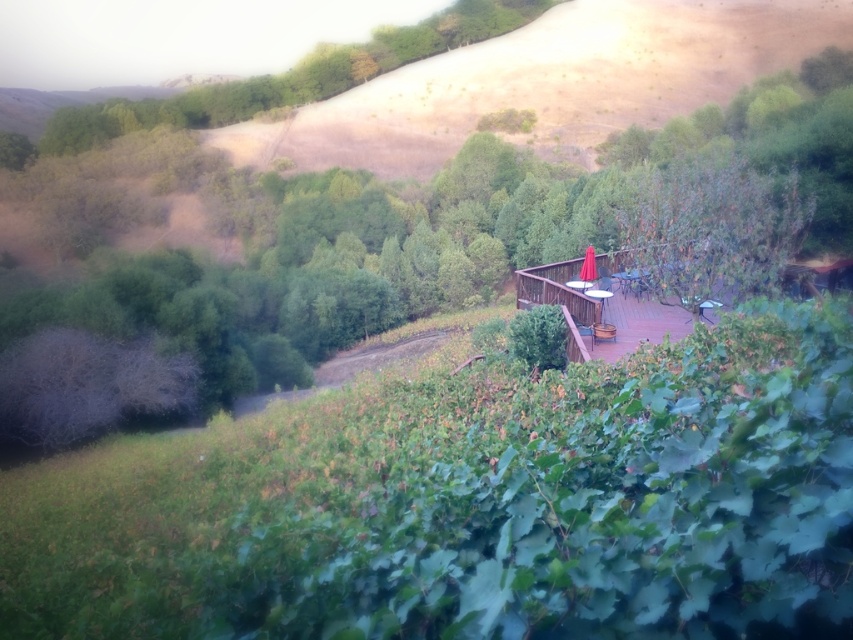
Who is more distant from viewer, (293,384) or (779,276)?

The point (293,384) is behind.

Consider the image. How much distance is there between green leafy tree at center and green leafy tree at upper right?

green leafy tree at center is 38.17 meters away from green leafy tree at upper right.

The image size is (853, 640). I want to click on green leafy tree at center, so click(x=376, y=252).

Is point (428, 204) positioned behind point (521, 26)?

No.

Which is in front, point (148, 333) or point (178, 108)?

Point (148, 333) is in front.

Does point (258, 205) come in front of point (302, 58)?

Yes, point (258, 205) is in front of point (302, 58).

The image size is (853, 640). I want to click on green leafy tree at center, so [376, 252].

Is green leafy tree at upper right shorter than green leafy tree at upper center?

Indeed, green leafy tree at upper right has a lesser height compared to green leafy tree at upper center.

Is point (750, 269) positioned behind point (206, 122)?

No.

Who is more distant from viewer, (746,288) or (248,86)?

Positioned behind is point (248,86).

Identify the location of green leafy tree at upper right. (712, 228).